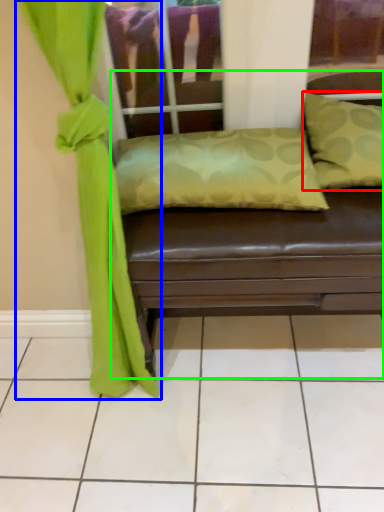
Question: Which is farther away from pillow (highlighted by a red box)? curtain (highlighted by a blue box) or studio couch (highlighted by a green box)?

Choices:
 (A) curtain
 (B) studio couch

Answer: (A)